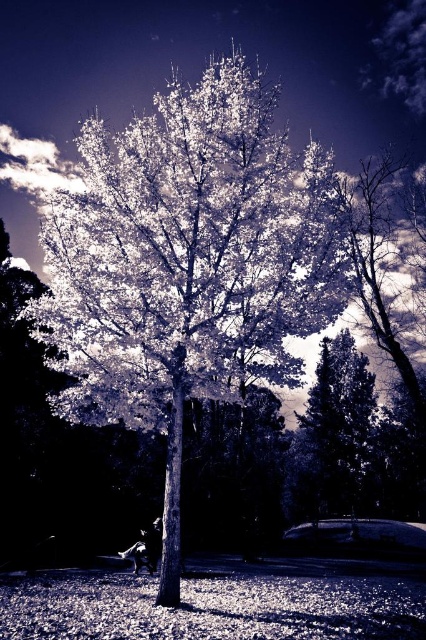
Consider the image. Which is below, white textured tree at center or smooth bark tree at lower right?

Positioned lower is smooth bark tree at lower right.

Who is higher up, white textured tree at center or smooth bark tree at lower right?

white textured tree at center is above.

Is point (281, 166) farther from viewer compared to point (357, 445)?

No, (281, 166) is in front of (357, 445).

Locate an element on the screen. This screenshot has width=426, height=640. white textured tree at center is located at coordinates (189, 262).